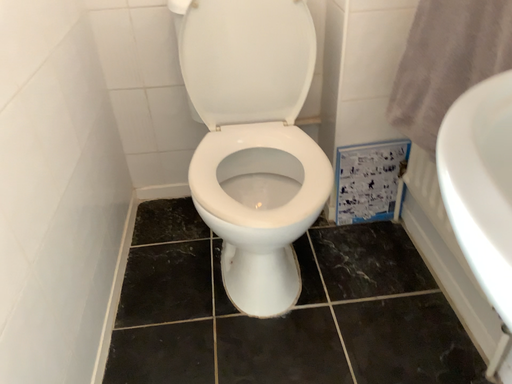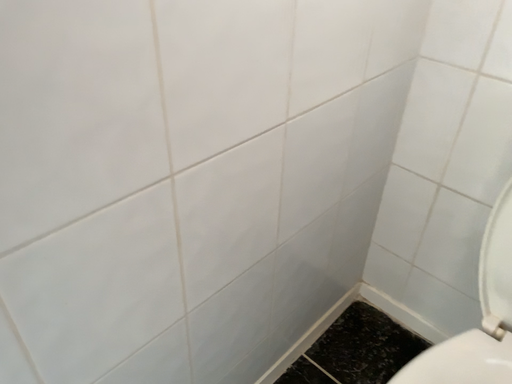
Question: Which way did the camera rotate in the video?

Choices:
 (A) rotated right
 (B) rotated left

Answer: (B)